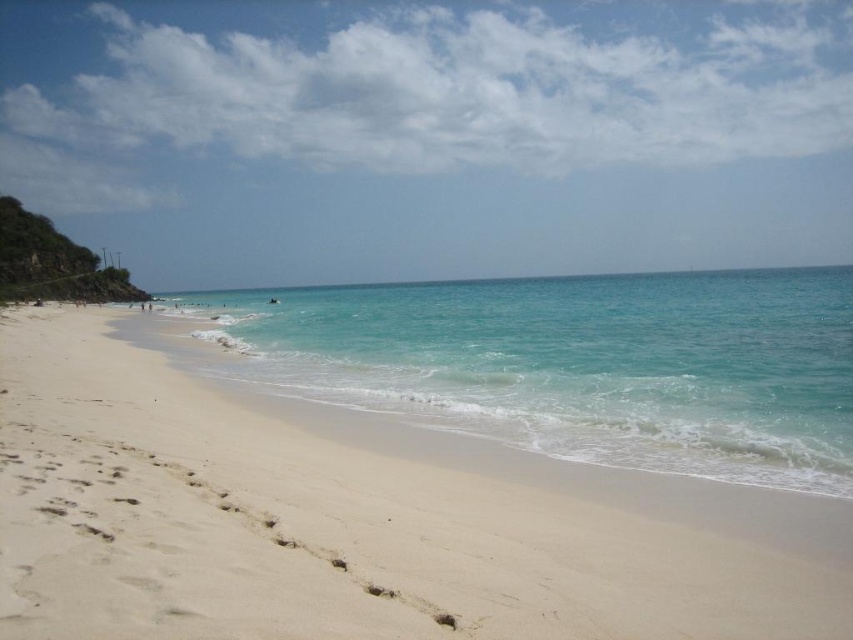
You are standing on the white sandy beach at lower left and want to reach the clear blue water at center. Which direction should you walk to get there?

Since the white sandy beach at lower left is positioned under the clear blue water at center, you should walk forward towards the clear blue water at center to reach it.

You are standing at the center of the image and want to walk to the white sandy beach at lower left. Which direction should you face to head directly towards it?

You should face towards the lower left direction to head directly towards the white sandy beach at lower left since it is located at point (355, 522) which is in the lower left quadrant of the image.

You are standing on the beach and see two points marked on the image. One is at point (502, 544) and the other at point (735, 369). Which point is closer to you?

Point (502, 544) is in front of point (735, 369), so it is closer to you.